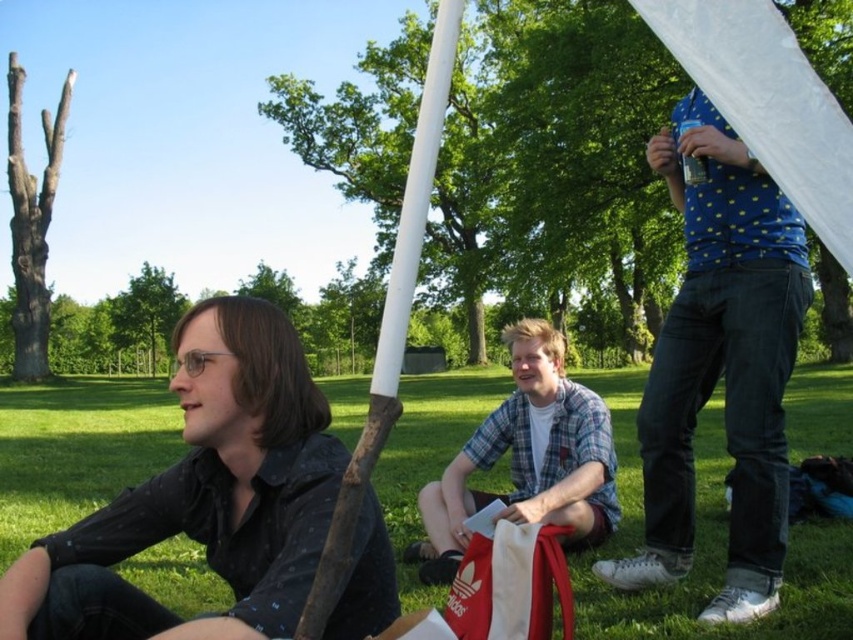
What do you see at coordinates (527, 458) in the screenshot?
I see `plaid fabric shirt at center` at bounding box center [527, 458].

Does plaid fabric shirt at center have a lesser height compared to white smooth pole at center?

Yes, plaid fabric shirt at center is shorter than white smooth pole at center.

You are a GUI agent. You are given a task and a screenshot of the screen. Output one action in this format:
    pyautogui.click(x=<x>, y=<y>)
    Task: Click on the plaid fabric shirt at center
    The width and height of the screenshot is (853, 640).
    Given the screenshot: What is the action you would take?
    pyautogui.click(x=527, y=458)

This screenshot has width=853, height=640. I want to click on plaid fabric shirt at center, so click(x=527, y=458).

Which is behind, point (213, 580) or point (405, 230)?

Positioned behind is point (213, 580).

Measure the distance between green grass at lower center and camera.

green grass at lower center is 3.47 meters from camera.

Does point (155, 387) come in front of point (354, 524)?

That is False.

This screenshot has height=640, width=853. I want to click on green grass at lower center, so click(x=705, y=547).

Does green grass at lower center appear over black dotted shirt at left?

Actually, green grass at lower center is below black dotted shirt at left.

Is green grass at lower center to the right of black dotted shirt at left from the viewer's perspective?

Incorrect, green grass at lower center is not on the right side of black dotted shirt at left.

Which is in front, point (706, 472) or point (238, 541)?

Point (238, 541)

You are a GUI agent. You are given a task and a screenshot of the screen. Output one action in this format:
    pyautogui.click(x=<x>, y=<y>)
    Task: Click on the green grass at lower center
    
    Given the screenshot: What is the action you would take?
    pyautogui.click(x=705, y=547)